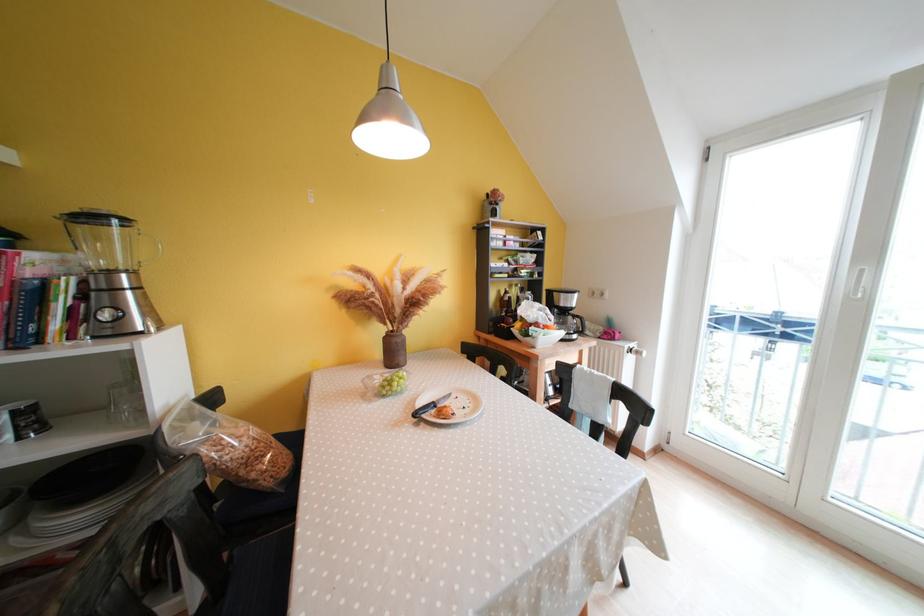
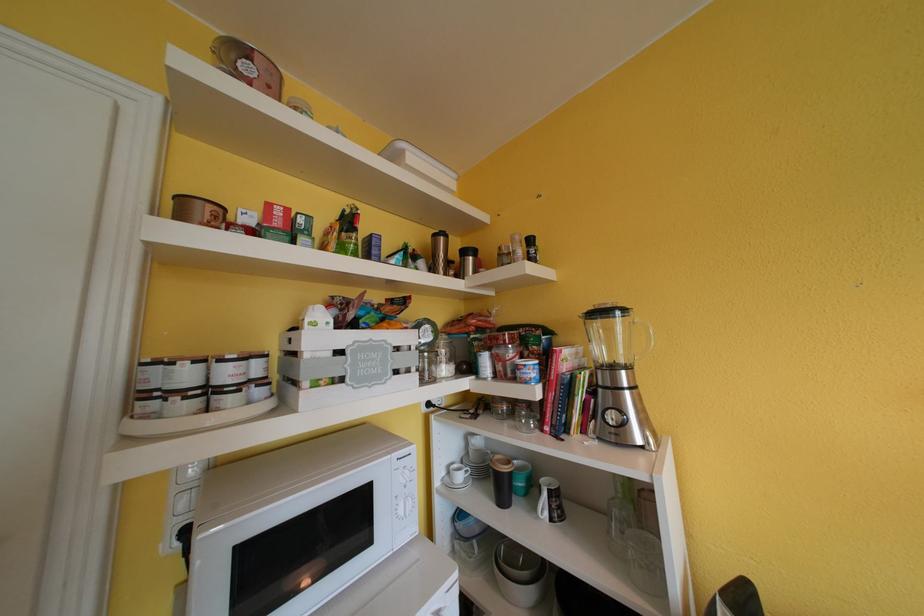
Question: The camera is either moving clockwise (left) or counter-clockwise (right) around the object. The first image is from the beginning of the video and the second image is from the end. Is the camera moving left or right when shooting the video?

Choices:
 (A) Left
 (B) Right

Answer: (B)